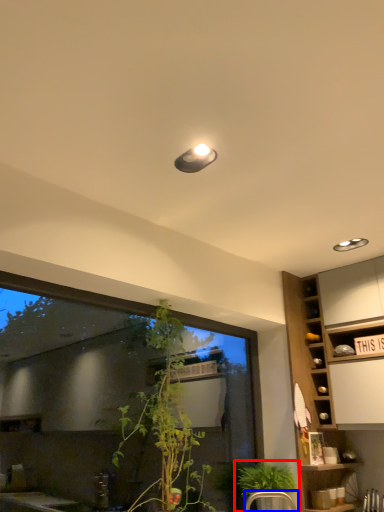
Question: Among these objects, which one is farthest to the camera, houseplant (highlighted by a red box) or armchair (highlighted by a blue box)?

Choices:
 (A) houseplant
 (B) armchair

Answer: (A)